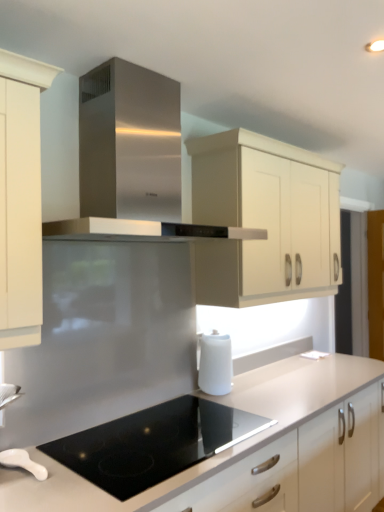
The width and height of the screenshot is (384, 512). What do you see at coordinates (23, 462) in the screenshot?
I see `white glossy spoon at lower left, arranged as the first kitchen appliance when viewed from the left` at bounding box center [23, 462].

Locate an element on the screen. The image size is (384, 512). cream matte cabinet at upper center is located at coordinates (260, 216).

This screenshot has width=384, height=512. In order to click on black glass cooktop at center in this screenshot , I will do `click(153, 443)`.

What do you see at coordinates (153, 443) in the screenshot?
I see `black glass cooktop at center` at bounding box center [153, 443].

Measure the distance between point (x=301, y=376) and camera.

The distance of point (x=301, y=376) from camera is 8.01 feet.

Locate an element on the screen. This screenshot has height=512, width=384. stainless steel range hood at center is located at coordinates (127, 147).

Measure the distance between point [83,166] and camera.

Point [83,166] is 1.76 meters from camera.

At what (x,y) coordinates should I click in order to perform the action: click on white glossy spoon at lower left, the second kitchen appliance from the back. Please return your answer as a coordinate pair (x, y). Looking at the image, I should click on (23, 462).

From the image's perspective, which one is positioned lower, stainless steel range hood at center or white matte kettle at lower center, the first kitchen appliance viewed from the back?

white matte kettle at lower center, the first kitchen appliance viewed from the back.

Does stainless steel range hood at center contain white matte kettle at lower center, the first kitchen appliance viewed from the back?

No, white matte kettle at lower center, the first kitchen appliance viewed from the back, is not surrounded by stainless steel range hood at center.

Who is taller, stainless steel range hood at center or white matte kettle at lower center, positioned as the 1th kitchen appliance in right-to-left order?

stainless steel range hood at center.

Can you tell me how much stainless steel range hood at center and white matte kettle at lower center, positioned as the 1th kitchen appliance in right-to-left order, differ in facing direction?

0.18 degrees.

Which object is more forward, white matte kettle at lower center, the 1th kitchen appliance viewed from the top, or cream matte cabinet at upper center?

cream matte cabinet at upper center is closer to the camera.

Which point is more forward, [213,375] or [289,249]?

Positioned in front is point [213,375].

Based on their sizes in the image, would you say white matte kettle at lower center, the 2th kitchen appliance in the bottom-to-top sequence, is bigger or smaller than cream matte cabinet at upper center?

In the image, white matte kettle at lower center, the 2th kitchen appliance in the bottom-to-top sequence, appears to be smaller than cream matte cabinet at upper center.

From the picture: Is the position of white matte kettle at lower center, positioned as the 1th kitchen appliance in right-to-left order, more distant than that of white glossy spoon at lower left, which is the first kitchen appliance from front to back?

Yes, white matte kettle at lower center, positioned as the 1th kitchen appliance in right-to-left order, is further from the viewer.

From a real-world perspective, which is physically above, white matte kettle at lower center, the second kitchen appliance positioned from the front, or white glossy spoon at lower left, the second kitchen appliance in the top-to-bottom sequence?

white matte kettle at lower center, the second kitchen appliance positioned from the front, from a real-world perspective.

Is white matte kettle at lower center, positioned as the 1th kitchen appliance in right-to-left order, to the left or to the right of white glossy spoon at lower left, the 2th kitchen appliance positioned from the right, in the image?

Clearly, white matte kettle at lower center, positioned as the 1th kitchen appliance in right-to-left order, is on the right of white glossy spoon at lower left, the 2th kitchen appliance positioned from the right, in the image.

Is point (211, 365) closer to viewer compared to point (149, 430)?

That is False.

Looking at their sizes, would you say white matte kettle at lower center, the 2th kitchen appliance in the bottom-to-top sequence, is wider or thinner than black glass cooktop at center?

Clearly, white matte kettle at lower center, the 2th kitchen appliance in the bottom-to-top sequence, has less width compared to black glass cooktop at center.

Based on their sizes in the image, would you say white matte kettle at lower center, which is the second kitchen appliance from left to right, is bigger or smaller than black glass cooktop at center?

white matte kettle at lower center, which is the second kitchen appliance from left to right, is smaller than black glass cooktop at center.

From the image's perspective, would you say white matte kettle at lower center, the 1th kitchen appliance viewed from the top, is shown under black glass cooktop at center?

No, from the image's perspective, white matte kettle at lower center, the 1th kitchen appliance viewed from the top, is not below black glass cooktop at center.

Does white matte kettle at lower center, the first kitchen appliance viewed from the back, have a greater width compared to white matte countertop at center?

Incorrect, the width of white matte kettle at lower center, the first kitchen appliance viewed from the back, does not surpass that of white matte countertop at center.

From a real-world perspective, relative to white matte countertop at center, is white matte kettle at lower center, which is the second kitchen appliance from left to right, vertically above or below?

white matte kettle at lower center, which is the second kitchen appliance from left to right, is above white matte countertop at center.

Who is shorter, white matte kettle at lower center, the second kitchen appliance positioned from the front, or white matte countertop at center?

white matte kettle at lower center, the second kitchen appliance positioned from the front, is shorter.

From the image's perspective, which object appears higher, white matte kettle at lower center, the second kitchen appliance positioned from the front, or white matte countertop at center?

white matte kettle at lower center, the second kitchen appliance positioned from the front, appears higher in the image.

In order to click on cabinetry that appears on the right of white matte countertop at center in this screenshot , I will do `click(260, 216)`.

Consider the image. Which object is further away from the camera taking this photo, white matte countertop at center or cream matte cabinet at upper center?

cream matte cabinet at upper center is further away from the camera.

Can you tell me how much white matte countertop at center and cream matte cabinet at upper center differ in facing direction?

0.755 degrees separate the facing orientations of white matte countertop at center and cream matte cabinet at upper center.

In the scene shown: Is stainless steel range hood at center taller than white glossy spoon at lower left, which is counted as the first kitchen appliance, starting from the bottom?

Yes.

Is stainless steel range hood at center facing away from white glossy spoon at lower left, which is the first kitchen appliance from front to back?

stainless steel range hood at center is not turned away from white glossy spoon at lower left, which is the first kitchen appliance from front to back.

Where is `home appliance in front of the white glossy spoon at lower left, the 2th kitchen appliance positioned from the right`? The image size is (384, 512). home appliance in front of the white glossy spoon at lower left, the 2th kitchen appliance positioned from the right is located at coordinates (127, 147).

From the image's perspective, is stainless steel range hood at center positioned above or below white glossy spoon at lower left, the second kitchen appliance from the back?

Clearly, from the image's perspective, stainless steel range hood at center is above white glossy spoon at lower left, the second kitchen appliance from the back.

Find the location of a particular element. The width and height of the screenshot is (384, 512). home appliance above the white matte kettle at lower center, the 1th kitchen appliance viewed from the top (from the image's perspective) is located at coordinates pos(127,147).

From a real-world perspective, count 1st kitchen appliances downward from the cream matte cabinet at upper center and point to it. Please provide its 2D coordinates.

[(215, 364)]

From the image, which object appears to be farther from stainless steel range hood at center, white matte countertop at center or white glossy spoon at lower left, the second kitchen appliance in the top-to-bottom sequence?

Based on the image, white matte countertop at center appears to be further to stainless steel range hood at center.

Looking at the image, which one is located closer to cream matte cabinet at upper center, white glossy spoon at lower left, arranged as the first kitchen appliance when viewed from the left, or white matte countertop at center?

The object closer to cream matte cabinet at upper center is white matte countertop at center.

Based on their spatial positions, is white glossy spoon at lower left, the second kitchen appliance from the back, or white matte kettle at lower center, which is the second kitchen appliance from left to right, further from stainless steel range hood at center?

Based on the image, white glossy spoon at lower left, the second kitchen appliance from the back, appears to be further to stainless steel range hood at center.

Estimate the real-world distances between objects in this image. Which object is further from white matte kettle at lower center, which is the second kitchen appliance from left to right, black glass cooktop at center or white glossy spoon at lower left, arranged as the first kitchen appliance when viewed from the left?

white glossy spoon at lower left, arranged as the first kitchen appliance when viewed from the left.

When comparing their distances from cream matte cabinet at upper center, does black glass cooktop at center or white matte countertop at center seem further?

black glass cooktop at center lies further to cream matte cabinet at upper center than the other object.

Based on their spatial positions, is white glossy spoon at lower left, arranged as the first kitchen appliance when viewed from the left, or white matte countertop at center closer to stainless steel range hood at center?

The object closer to stainless steel range hood at center is white glossy spoon at lower left, arranged as the first kitchen appliance when viewed from the left.

Which object lies nearer to the anchor point white glossy spoon at lower left, the second kitchen appliance in the top-to-bottom sequence, stainless steel range hood at center or black glass cooktop at center?

black glass cooktop at center lies closer to white glossy spoon at lower left, the second kitchen appliance in the top-to-bottom sequence, than the other object.

Considering their positions, is white glossy spoon at lower left, arranged as the first kitchen appliance when viewed from the left, positioned closer to stainless steel range hood at center than black glass cooktop at center?

The object closer to stainless steel range hood at center is black glass cooktop at center.

The width and height of the screenshot is (384, 512). What are the coordinates of `kitchen appliance between black glass cooktop at center and white matte kettle at lower center, the first kitchen appliance viewed from the back, along the z-axis` in the screenshot? It's located at (23, 462).

Where is `kitchen appliance situated between white glossy spoon at lower left, which is counted as the first kitchen appliance, starting from the bottom, and cream matte cabinet at upper center from left to right`? The image size is (384, 512). kitchen appliance situated between white glossy spoon at lower left, which is counted as the first kitchen appliance, starting from the bottom, and cream matte cabinet at upper center from left to right is located at coordinates (215, 364).

Image resolution: width=384 pixels, height=512 pixels. I want to click on kitchen appliance between stainless steel range hood at center and black glass cooktop at center from top to bottom, so click(x=215, y=364).

This screenshot has width=384, height=512. I want to click on kitchen appliance between stainless steel range hood at center and white glossy spoon at lower left, the second kitchen appliance from the back, in the vertical direction, so click(x=215, y=364).